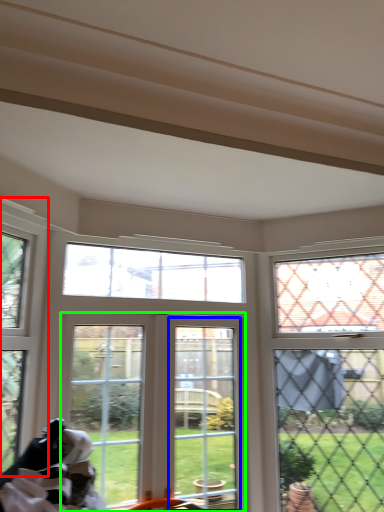
Question: Which object is positioned farthest from window (highlighted by a red box)? Select from window frame (highlighted by a blue box) and window (highlighted by a green box).

Choices:
 (A) window frame
 (B) window

Answer: (A)